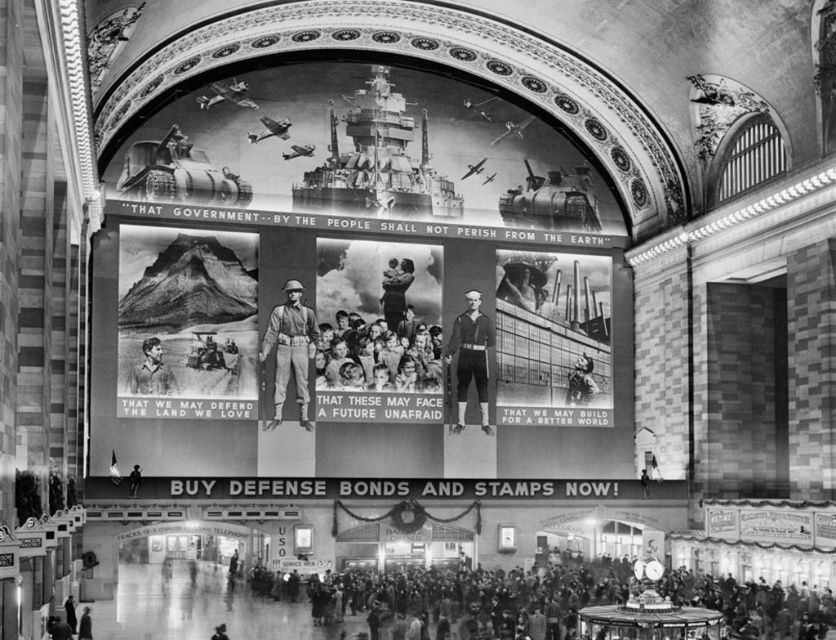
In the scene shown: You are standing in the train station and want to take a photo of the two points mentioned. Which point, point (x=146, y=314) or point (x=386, y=272), will appear larger in your photo?

Point (x=146, y=314) is closer to the camera than point (x=386, y=272), so it will appear larger in the photo.